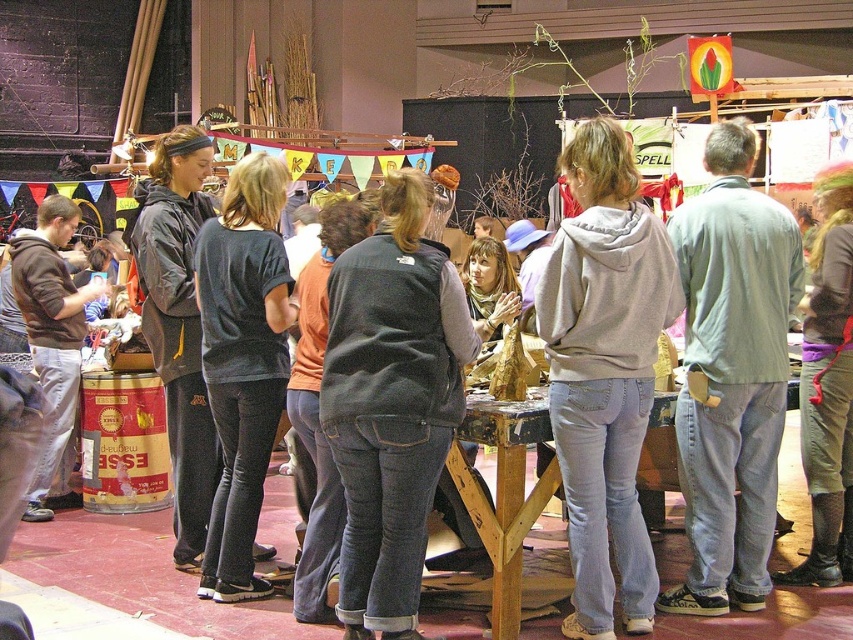
Does dark gray sweater at center have a larger size compared to greenish-gray fabric pants at center-right?

Actually, dark gray sweater at center might be smaller than greenish-gray fabric pants at center-right.

Between point (286, 289) and point (840, 291), which one is positioned behind?

The point (840, 291) is behind.

Locate an element on the screen. The image size is (853, 640). dark gray sweater at center is located at coordinates (242, 362).

Is dark gray fleece vest at center shorter than light gray shirt at center?

Yes.

Between point (351, 428) and point (688, 300), which one is positioned in front?

Point (351, 428) is more forward.

Where is `dark gray fleece vest at center`? Image resolution: width=853 pixels, height=640 pixels. dark gray fleece vest at center is located at coordinates (392, 403).

Does dark gray fleece vest at center have a lesser height compared to brown hoodie at left?

Indeed, dark gray fleece vest at center has a lesser height compared to brown hoodie at left.

Between dark gray fleece vest at center and brown hoodie at left, which one is positioned higher?

brown hoodie at left is higher up.

Where is `dark gray fleece vest at center`? dark gray fleece vest at center is located at coordinates click(392, 403).